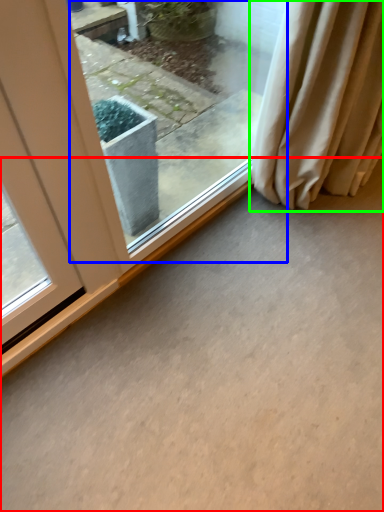
Question: Which is nearer to the concrete (highlighted by a red box)? window (highlighted by a blue box) or curtain (highlighted by a green box).

Choices:
 (A) window
 (B) curtain

Answer: (B)